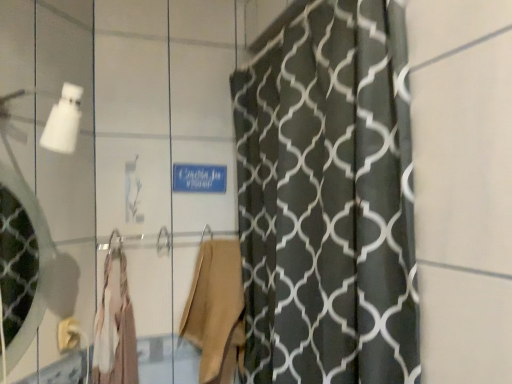
Question: Considering the relative positions of matte gold towel bar at lower left and light beige fabric robe at center, which is counted as the first robe, starting from the left, in the image provided, is matte gold towel bar at lower left to the right of light beige fabric robe at center, which is counted as the first robe, starting from the left, from the viewer's perspective?

Choices:
 (A) yes
 (B) no

Answer: (B)

Question: Can you confirm if matte gold towel bar at lower left is shorter than light beige fabric robe at center, acting as the second robe starting from the right?

Choices:
 (A) yes
 (B) no

Answer: (A)

Question: Does matte gold towel bar at lower left have a greater height compared to light beige fabric robe at center, which is counted as the first robe, starting from the left?

Choices:
 (A) yes
 (B) no

Answer: (B)

Question: Could you tell me if matte gold towel bar at lower left is turned towards light beige fabric robe at center, acting as the second robe starting from the right?

Choices:
 (A) no
 (B) yes

Answer: (A)

Question: Considering the relative sizes of matte gold towel bar at lower left and light beige fabric robe at center, acting as the second robe starting from the right, in the image provided, is matte gold towel bar at lower left bigger than light beige fabric robe at center, acting as the second robe starting from the right,?

Choices:
 (A) yes
 (B) no

Answer: (B)

Question: Visually, is clear glass mirror at left positioned to the left or to the right of beige fabric robe at center, which ranks as the 1th robe in right-to-left order?

Choices:
 (A) right
 (B) left

Answer: (B)

Question: Is point (x=34, y=306) positioned closer to the camera than point (x=211, y=296)?

Choices:
 (A) closer
 (B) farther

Answer: (A)

Question: Based on their sizes in the image, would you say clear glass mirror at left is bigger or smaller than beige fabric robe at center, which ranks as the 1th robe in right-to-left order?

Choices:
 (A) big
 (B) small

Answer: (B)

Question: Is clear glass mirror at left situated inside beige fabric robe at center, which ranks as the 1th robe in right-to-left order, or outside?

Choices:
 (A) inside
 (B) outside

Answer: (B)

Question: Is point (61, 332) positioned closer to the camera than point (204, 299)?

Choices:
 (A) farther
 (B) closer

Answer: (B)

Question: Considering the positions of matte gold towel bar at lower left and beige fabric robe at center, which ranks as the 1th robe in right-to-left order, in the image, is matte gold towel bar at lower left wider or thinner than beige fabric robe at center, which ranks as the 1th robe in right-to-left order,?

Choices:
 (A) wide
 (B) thin

Answer: (B)

Question: Would you say matte gold towel bar at lower left is to the left or to the right of beige fabric robe at center, the 2th robe from the left, in the picture?

Choices:
 (A) right
 (B) left

Answer: (B)

Question: Relative to beige fabric robe at center, which ranks as the 1th robe in right-to-left order, is matte gold towel bar at lower left in front or behind?

Choices:
 (A) front
 (B) behind

Answer: (A)

Question: From the image's perspective, is clear glass mirror at left positioned above or below matte gold towel bar at lower left?

Choices:
 (A) above
 (B) below

Answer: (A)

Question: Is clear glass mirror at left bigger or smaller than matte gold towel bar at lower left?

Choices:
 (A) small
 (B) big

Answer: (B)